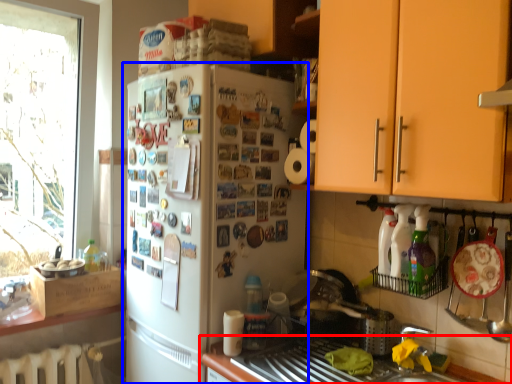
Question: Which point is closer to the camera, countertop (highlighted by a red box) or refrigerator (highlighted by a blue box)?

Choices:
 (A) countertop
 (B) refrigerator

Answer: (A)